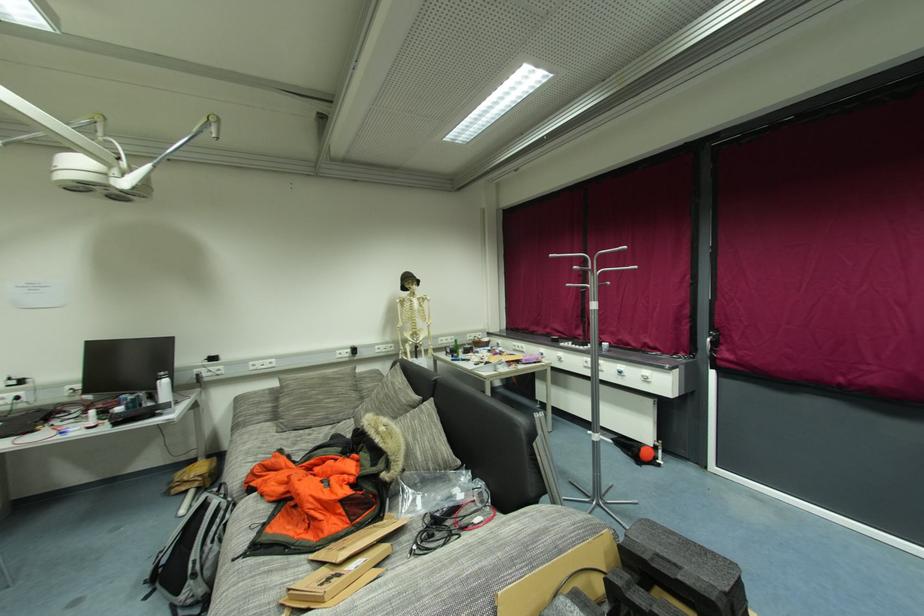
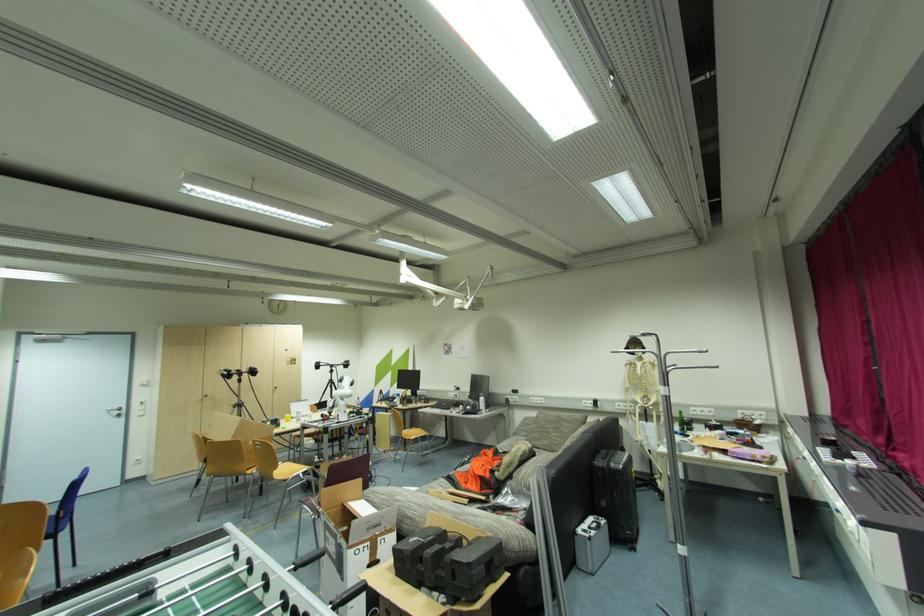
In the second image, find the point that corresponds to pixel 166 383 in the first image.

(484, 400)